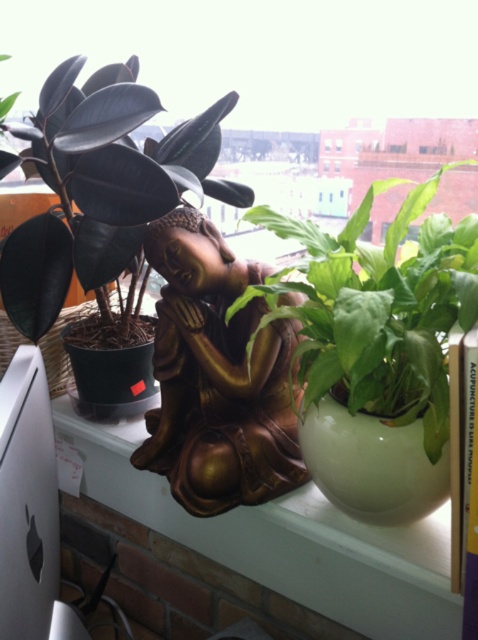
Question: Among these points, which one is farthest from the camera?

Choices:
 (A) (405, 198)
 (B) (242, 413)

Answer: (B)

Question: Does rubberleather-likeplant at center appear on the right side of green glossy leafy plant at center?

Choices:
 (A) no
 (B) yes

Answer: (A)

Question: Is rubberleather-likeplant at center smaller than gold polished statue at center?

Choices:
 (A) no
 (B) yes

Answer: (A)

Question: Which of the following is the farthest from the observer?

Choices:
 (A) (109, 250)
 (B) (467, 305)

Answer: (A)

Question: Which object is farther from the camera taking this photo?

Choices:
 (A) green glossy leafy plant at center
 (B) rubberleather-likeplant at center
 (C) gold polished statue at center

Answer: (C)

Question: Does rubberleather-likeplant at center have a smaller size compared to green glossy leafy plant at center?

Choices:
 (A) no
 (B) yes

Answer: (A)